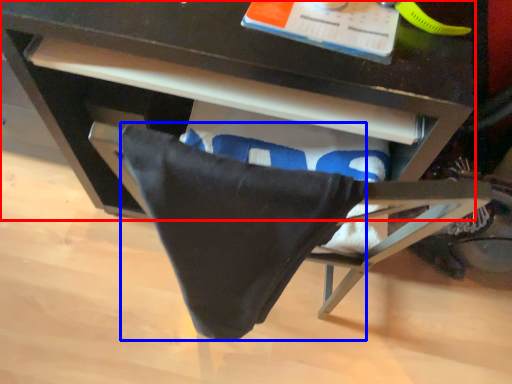
Question: Among these objects, which one is nearest to the camera, desk (highlighted by a red box) or blanket (highlighted by a blue box)?

Choices:
 (A) desk
 (B) blanket

Answer: (B)